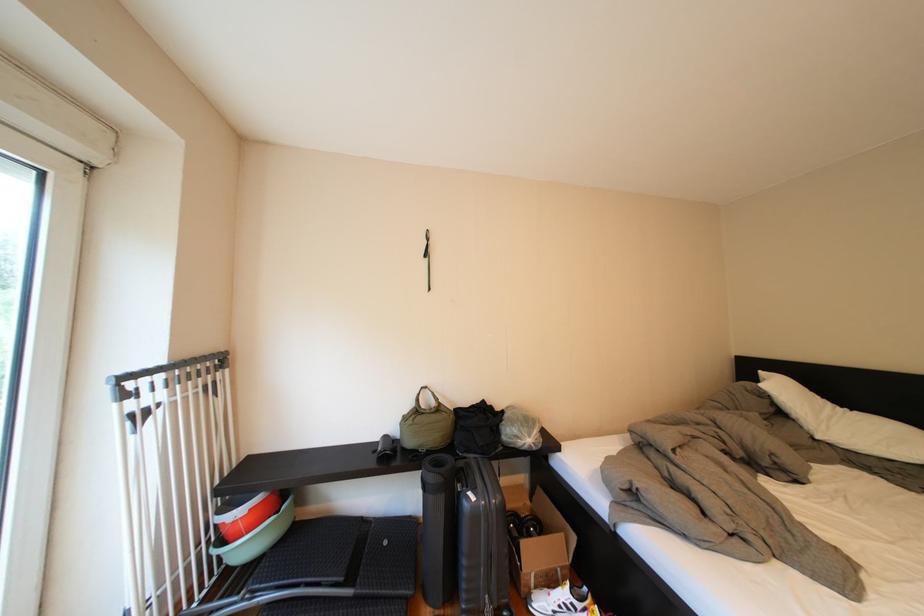
The location [338,568] corresponds to which object?

This point indicates the black rolled mat.